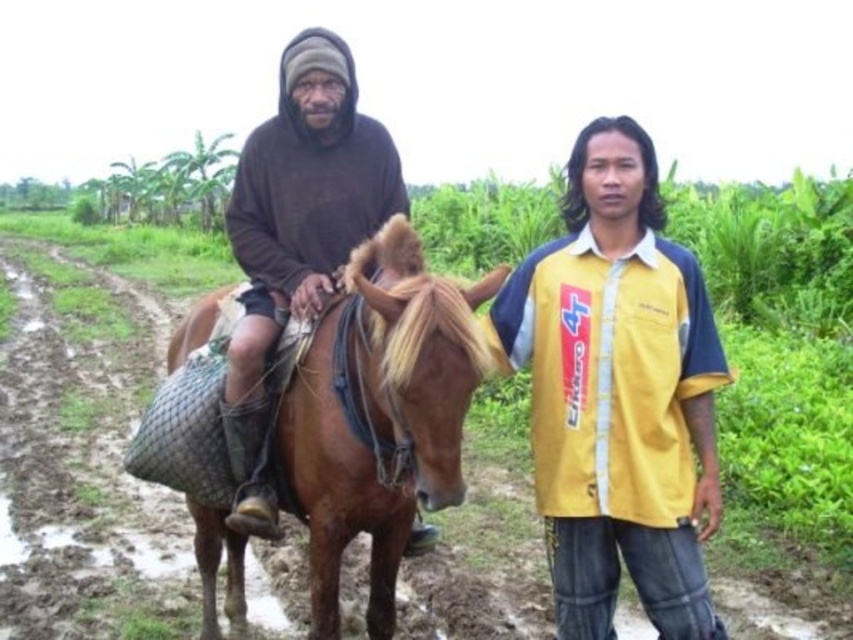
You are a delivery drone operator. Your drone is currently at the starting point and needs to fly to the destination point. The route must avoid the brown mud track at lower left. Which direction should the drone avoid flying towards?

The drone should avoid flying towards the lower left direction because the brown mud track at lower left is located at point (84, 461), which is in that direction.